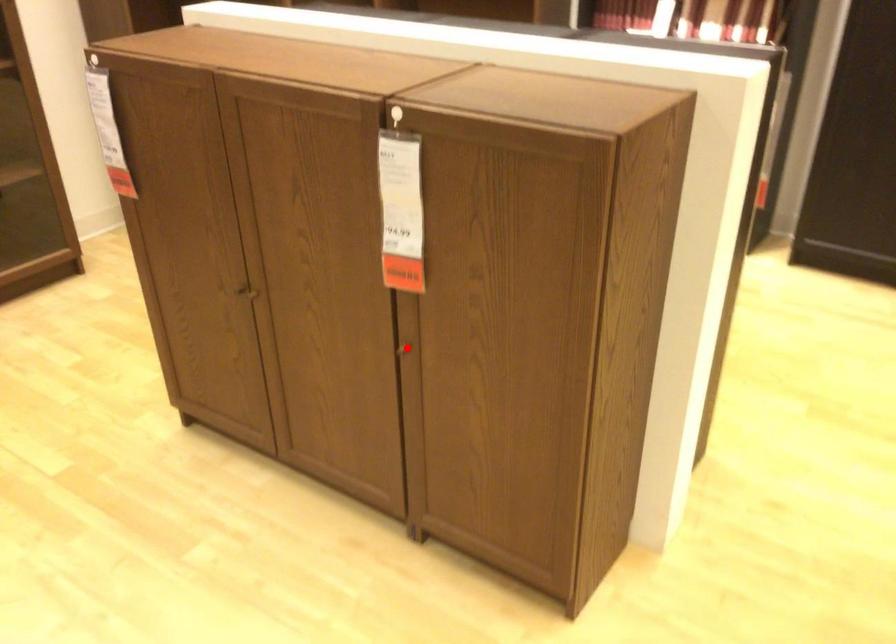
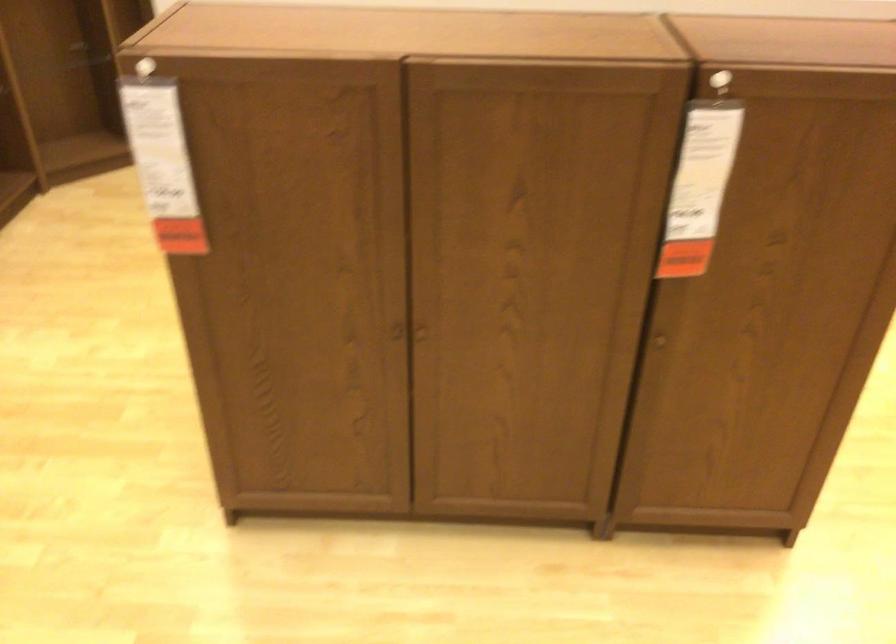
In the second image, find the point that corresponds to the highlighted location in the first image.

(659, 341)